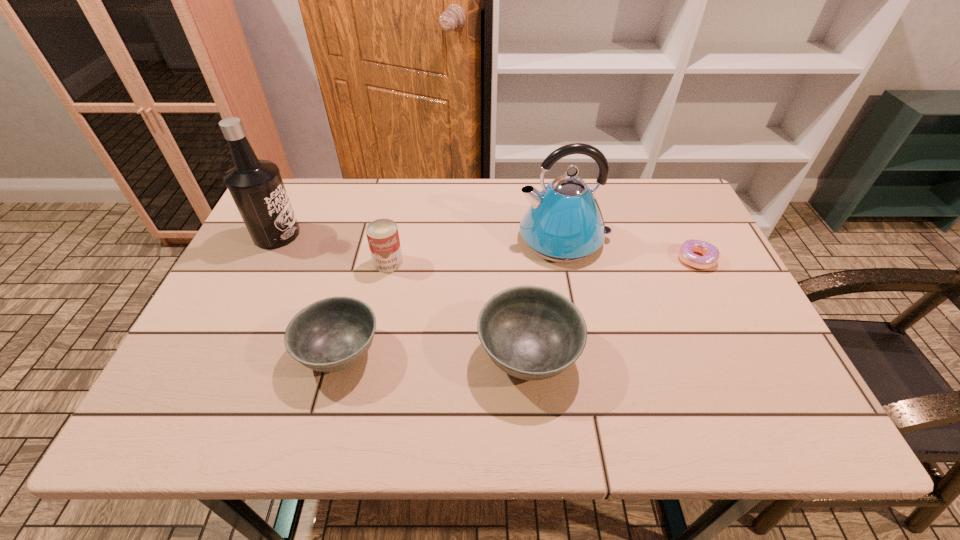
At what (x,y) coordinates should I click in order to perform the action: click on the shorter bowl. Please return your answer as a coordinate pair (x, y). The image size is (960, 540). Looking at the image, I should click on (332, 334).

Identify the location of the second shortest object. This screenshot has width=960, height=540. (332, 334).

Identify the location of the right bowl. The height and width of the screenshot is (540, 960). (530, 332).

You are a GUI agent. You are given a task and a screenshot of the screen. Output one action in this format:
    pyautogui.click(x=<x>, y=<y>)
    Task: Click on the kettle
    
    Given the screenshot: What is the action you would take?
    pyautogui.click(x=564, y=224)

Locate an element on the screen. This screenshot has width=960, height=540. liquor is located at coordinates (256, 186).

In order to click on can in this screenshot , I will do `click(382, 234)`.

What are the coordinates of `the shortest object` in the screenshot? It's located at (710, 253).

Find the location of `the rightmost object`. the rightmost object is located at coordinates (710, 253).

This screenshot has width=960, height=540. In order to click on vacant space located 0.150m on the left of the fifth tallest object in this screenshot , I will do `click(230, 352)`.

The width and height of the screenshot is (960, 540). In order to click on free location located on the left of the taller bowl in this screenshot , I will do `click(337, 355)`.